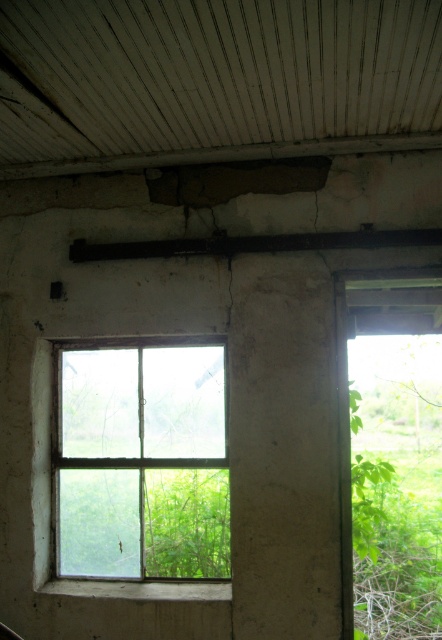
Question: Can you confirm if clear glass window at center is wider than black metal beam at upper center?

Choices:
 (A) yes
 (B) no

Answer: (B)

Question: Does clear glass window at center appear on the left side of black metal beam at upper center?

Choices:
 (A) no
 (B) yes

Answer: (B)

Question: Which point appears farthest from the camera in this image?

Choices:
 (A) (75, 240)
 (B) (132, 568)

Answer: (A)

Question: Is clear glass window at center bigger than black metal beam at upper center?

Choices:
 (A) yes
 (B) no

Answer: (A)